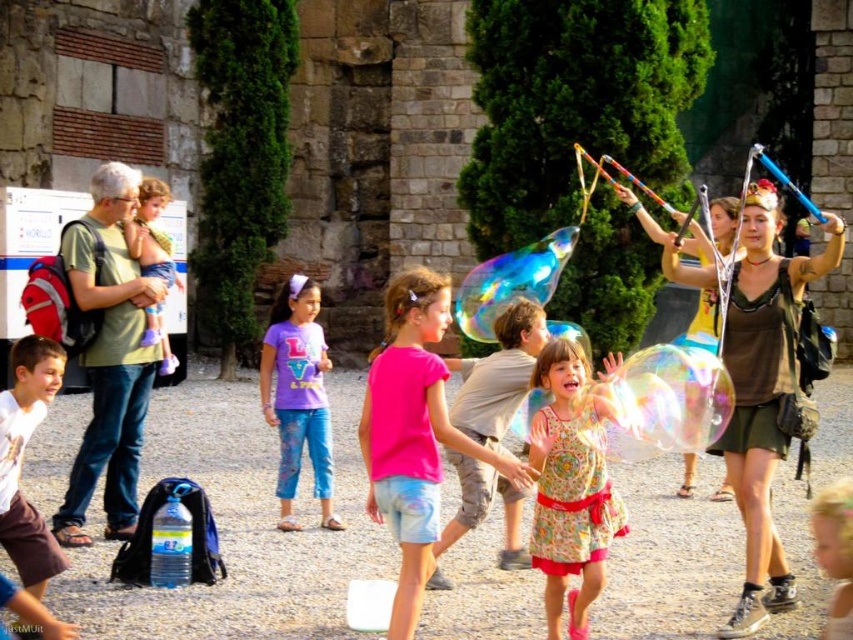
Question: Among these objects, which one is nearest to the camera?

Choices:
 (A) white cotton shirt at center
 (B) printed cotton dress at center
 (C) pink matte shirt at center
 (D) matte blue shirt at left

Answer: (C)

Question: Among these objects, which one is nearest to the camera?

Choices:
 (A) matte blue shirt at left
 (B) printed cotton dress at center

Answer: (B)

Question: Is white cotton shirt at center thinner than matte blue shirt at left?

Choices:
 (A) no
 (B) yes

Answer: (B)

Question: Which point is closer to the camera?

Choices:
 (A) matte blue shirt at left
 (B) white cotton shirt at center
 (C) pink matte shirt at center
 (D) printed cotton dress at center

Answer: (C)

Question: Does purple matte shirt at center appear over white cotton shirt at center?

Choices:
 (A) no
 (B) yes

Answer: (B)

Question: Is printed cotton dress at center wider than matte blue shirt at left?

Choices:
 (A) no
 (B) yes

Answer: (B)